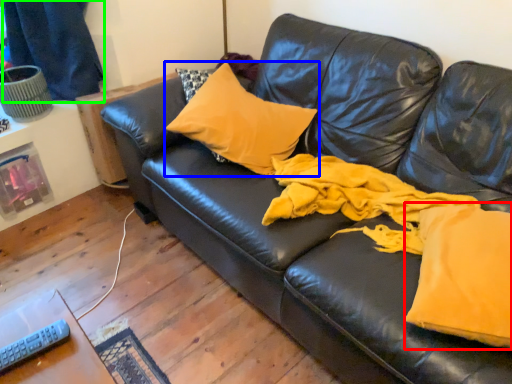
Question: Considering the real-world distances, which object is closest to fabric (highlighted by a red box)? pillow (highlighted by a blue box) or curtain (highlighted by a green box).

Choices:
 (A) pillow
 (B) curtain

Answer: (A)